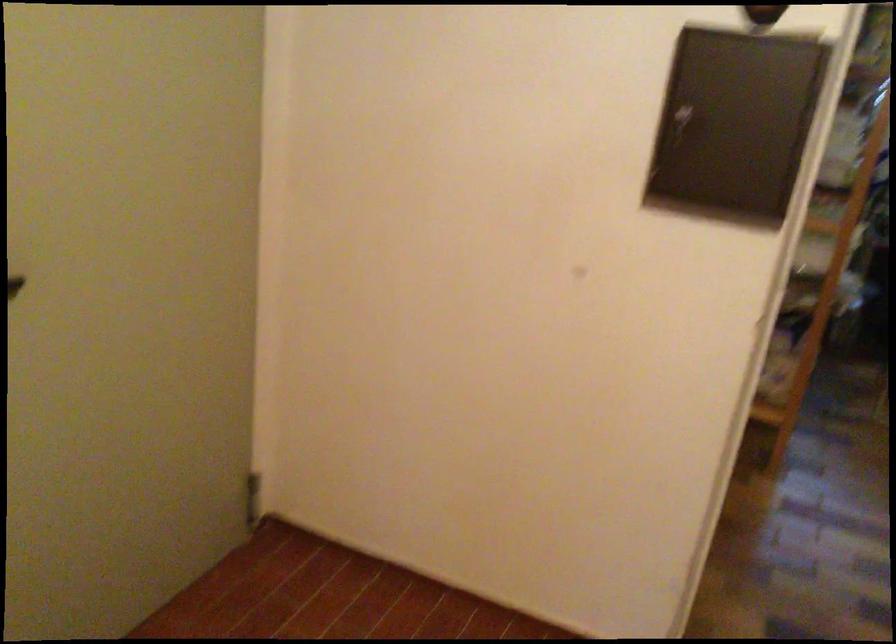
What do you see at coordinates (734, 122) in the screenshot? The image size is (896, 644). I see `a panel latch` at bounding box center [734, 122].